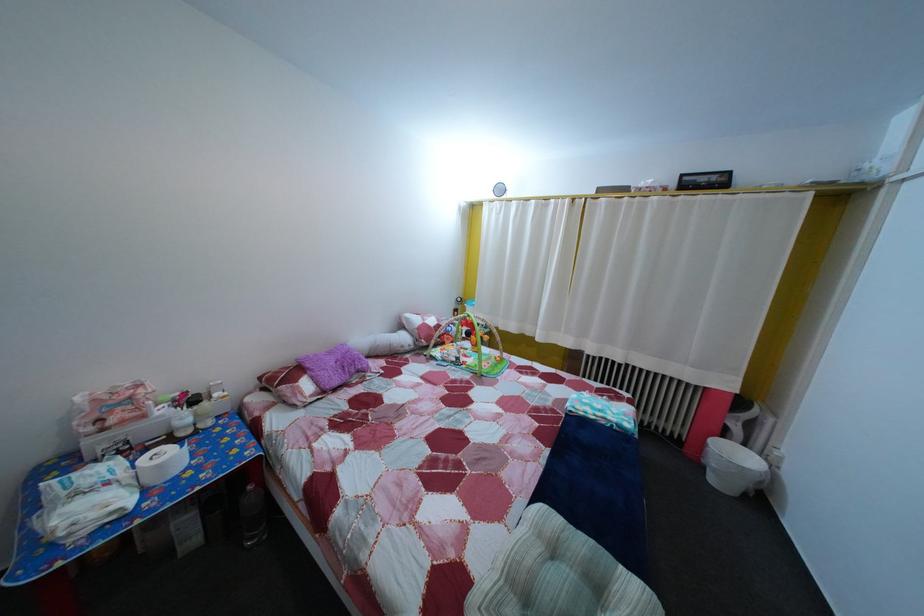
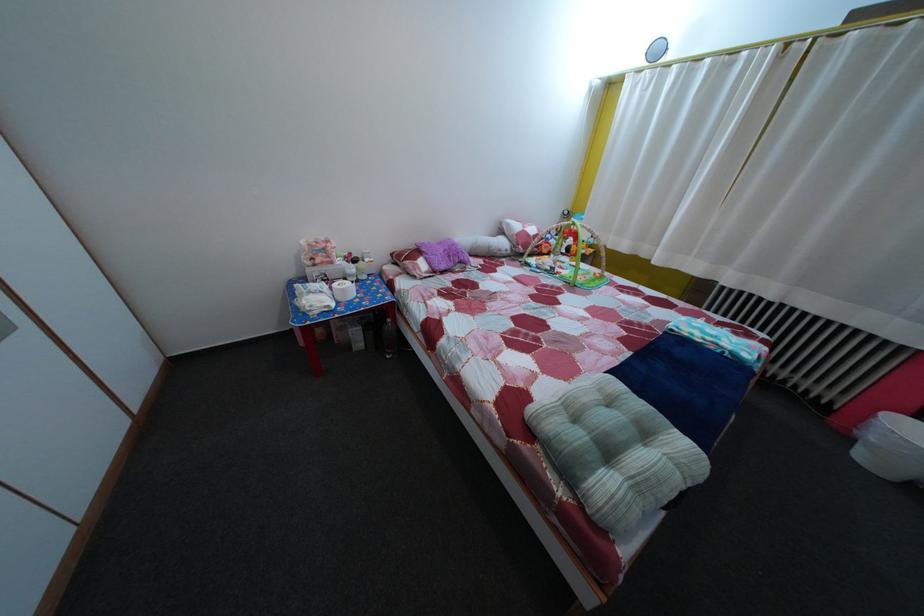
Locate, in the second image, the point that corresponds to the point at 339,361 in the first image.

(450, 252)